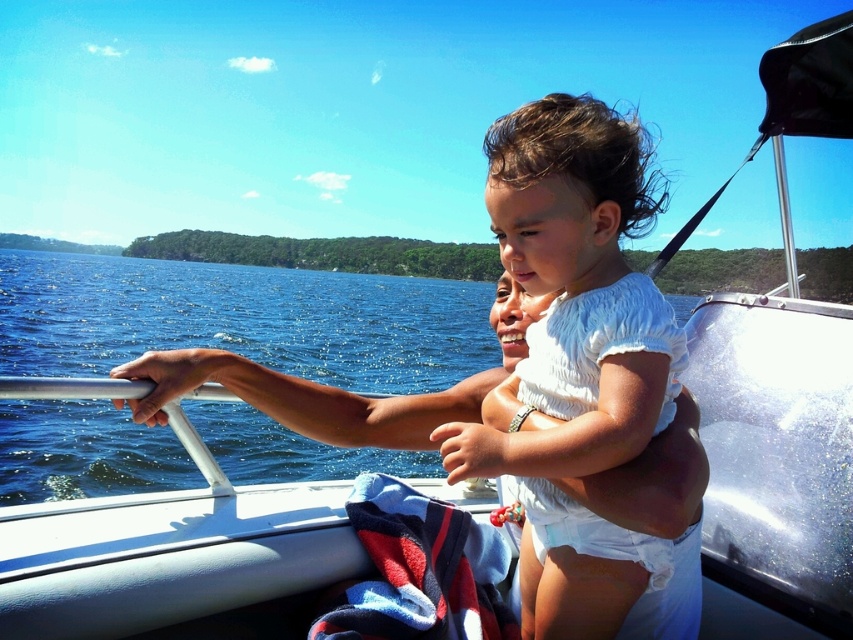
Question: Is blue water at left positioned before white cotton toddler at center?

Choices:
 (A) no
 (B) yes

Answer: (A)

Question: Which point is closer to the camera?

Choices:
 (A) (624, 300)
 (B) (318, 344)

Answer: (A)

Question: Can you confirm if blue water at left is positioned above white cotton toddler at center?

Choices:
 (A) no
 (B) yes

Answer: (B)

Question: Among these objects, which one is nearest to the camera?

Choices:
 (A) white cotton toddler at center
 (B) blue water at left

Answer: (A)

Question: Where is blue water at left located in relation to white cotton toddler at center in the image?

Choices:
 (A) below
 (B) above

Answer: (B)

Question: Which object appears farthest from the camera in this image?

Choices:
 (A) blue water at left
 (B) white cotton toddler at center

Answer: (A)